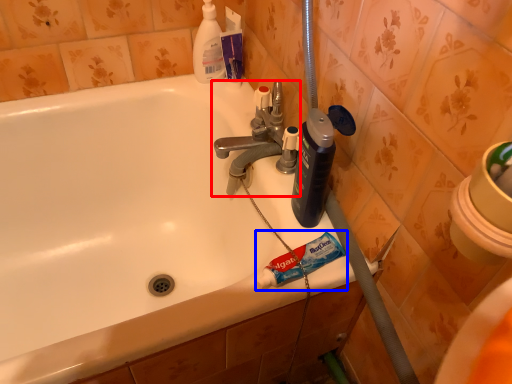
Question: Which point is closer to the camera, tap (highlighted by a red box) or toothpaste (highlighted by a blue box)?

Choices:
 (A) tap
 (B) toothpaste

Answer: (B)